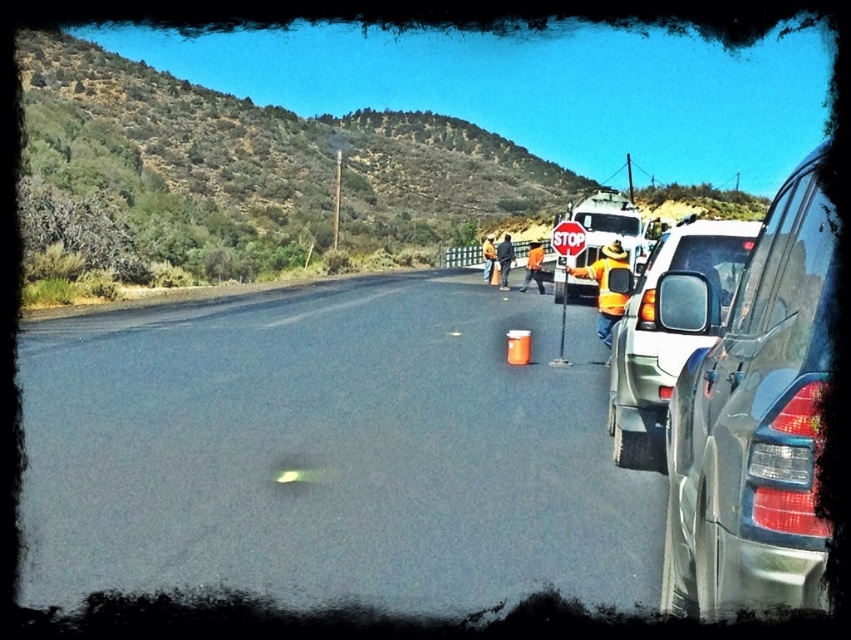
Question: Estimate the real-world distances between objects in this image. Which object is farther from the matte black suv at right?

Choices:
 (A) black asphalt road at center
 (B) satin silver sedan at right

Answer: (A)

Question: Which point is farther from the camera taking this photo?

Choices:
 (A) (284, 307)
 (B) (637, 410)

Answer: (A)

Question: Considering the relative positions of black asphalt road at center and satin silver sedan at right in the image provided, where is black asphalt road at center located with respect to satin silver sedan at right?

Choices:
 (A) left
 (B) right

Answer: (A)

Question: Does black asphalt road at center appear on the right side of matte black suv at right?

Choices:
 (A) no
 (B) yes

Answer: (A)

Question: Which point is farther to the camera?

Choices:
 (A) matte black suv at right
 (B) satin silver sedan at right
 (C) black asphalt road at center

Answer: (C)

Question: Does black asphalt road at center appear on the right side of satin silver sedan at right?

Choices:
 (A) yes
 (B) no

Answer: (B)